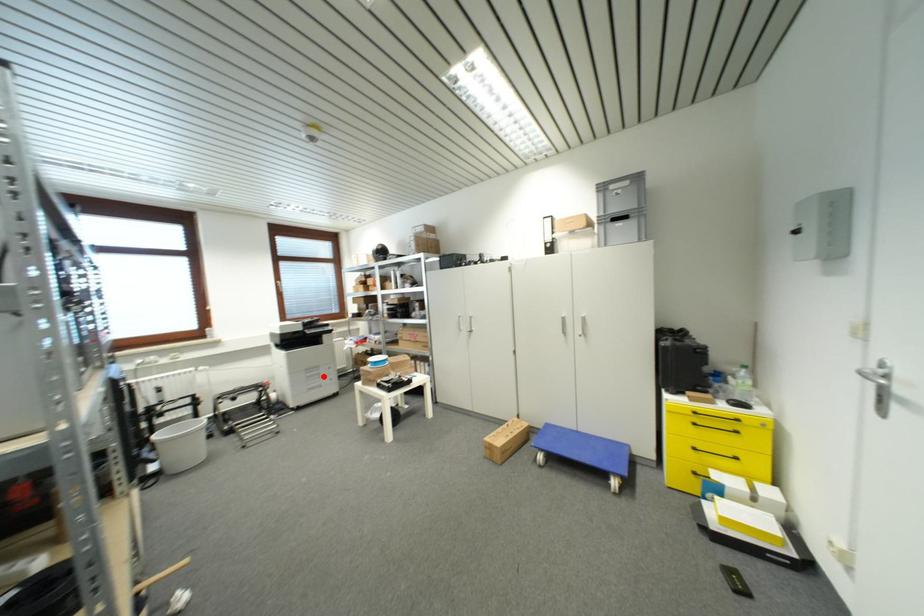
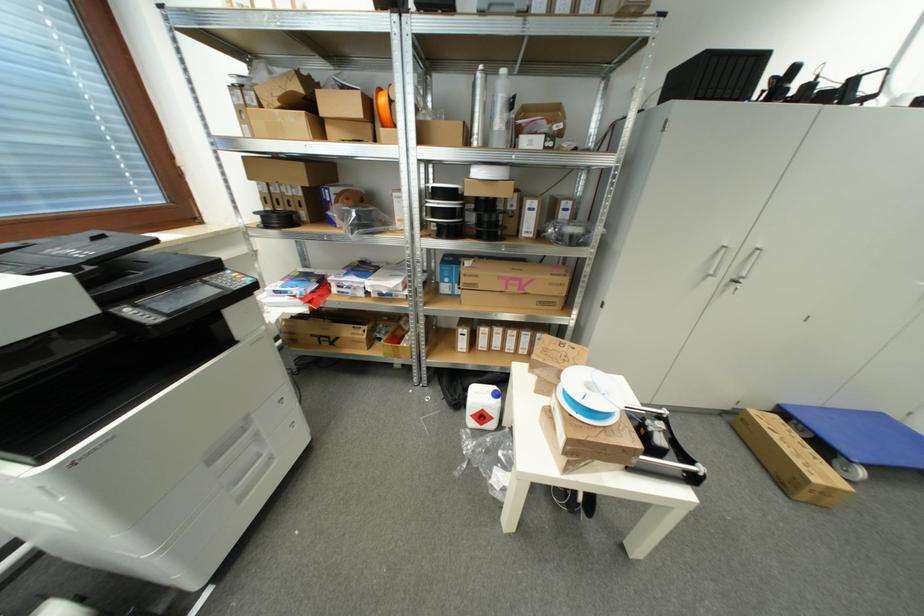
Question: I am providing you with two images of the same scene from different viewpoints. A red point is shown in image1. For the corresponding object point in image2, is it positioned nearer or farther from the camera?

Choices:
 (A) Nearer
 (B) Farther

Answer: (B)